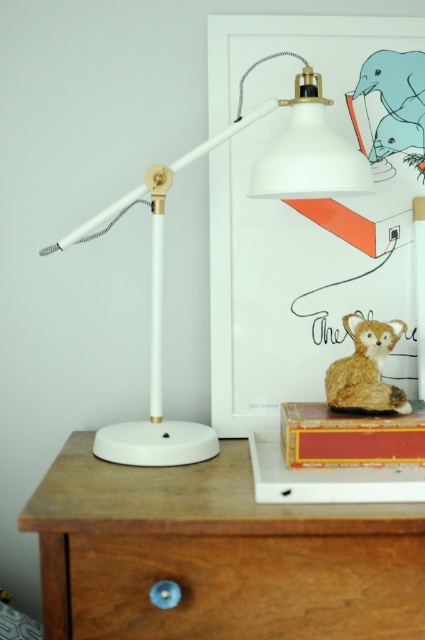
Question: Does wooden drawer at lower center appear under matte blue elephant at upper right?

Choices:
 (A) yes
 (B) no

Answer: (A)

Question: Does matte blue elephant at upper right appear on the right side of fuzzy brown cat at upper right?

Choices:
 (A) no
 (B) yes

Answer: (B)

Question: Which is farther from the white matte table lamp at center?

Choices:
 (A) wooden drawer at center
 (B) fuzzy brown cat at upper right
 (C) matte blue elephant at upper right
 (D) wooden drawer at lower center

Answer: (D)

Question: Does wooden drawer at center have a smaller size compared to matte blue elephant at upper right?

Choices:
 (A) yes
 (B) no

Answer: (B)

Question: Which point is farther to the camera?

Choices:
 (A) fuzzy brown cat at upper right
 (B) matte blue elephant at upper right

Answer: (B)

Question: Which object appears closest to the camera in this image?

Choices:
 (A) wooden drawer at center
 (B) fuzzy brown cat at upper right
 (C) wooden drawer at lower center
 (D) white matte table lamp at center

Answer: (A)